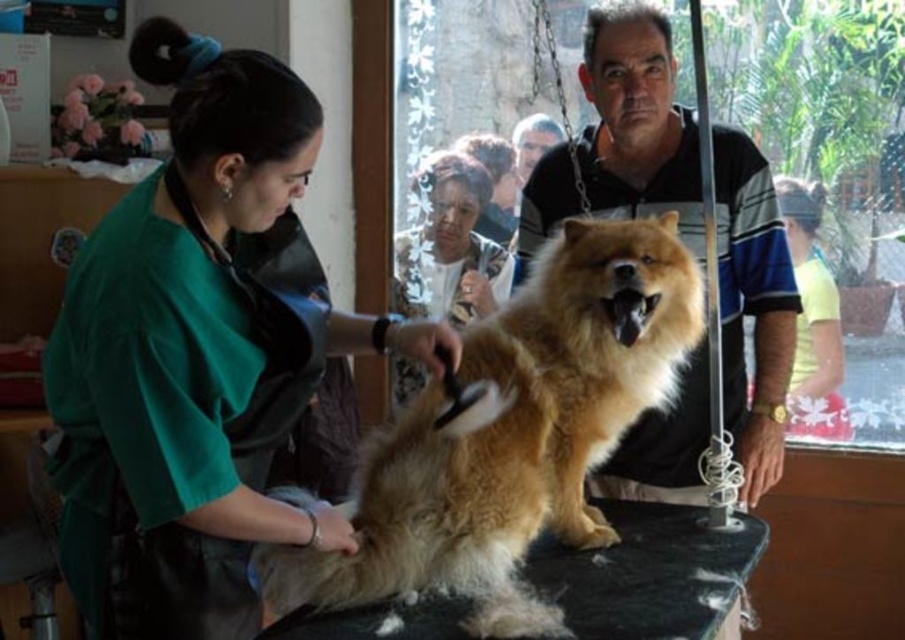
How far apart are black rubber table at center and fluffy brown fur at center?

black rubber table at center is 4.49 feet from fluffy brown fur at center.

Does black rubber table at center have a lesser height compared to fluffy brown fur at center?

Yes.

Identify the location of black rubber table at center. Image resolution: width=905 pixels, height=640 pixels. (648, 572).

What are the coordinates of `fuzzy golden dog at center` in the screenshot? It's located at (513, 435).

Which is above, fluffy brown dog at center or fluffy brown fur at center?

fluffy brown dog at center is higher up.

Can you confirm if fluffy brown dog at center is shorter than fluffy brown fur at center?

In fact, fluffy brown dog at center may be taller than fluffy brown fur at center.

What do you see at coordinates (637, 122) in the screenshot? The image size is (905, 640). I see `fluffy brown dog at center` at bounding box center [637, 122].

This screenshot has width=905, height=640. I want to click on fluffy brown dog at center, so click(637, 122).